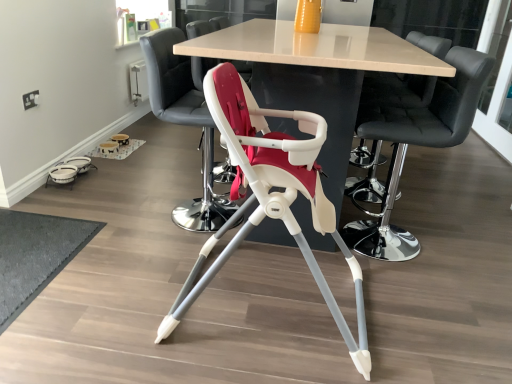
At what (x,y) coordinates should I click in order to perform the action: click on spots to the right of smooth black bar stool at center, placed as the first chair when sorted from right to left. Please return your answer as a coordinate pair (x, y). Looking at the image, I should click on click(431, 189).